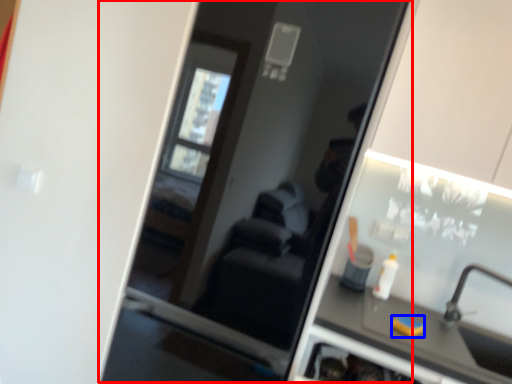
Question: Which object appears closest to the camera in this image, screen door (highlighted by a red box) or soap (highlighted by a blue box)?

Choices:
 (A) screen door
 (B) soap

Answer: (A)